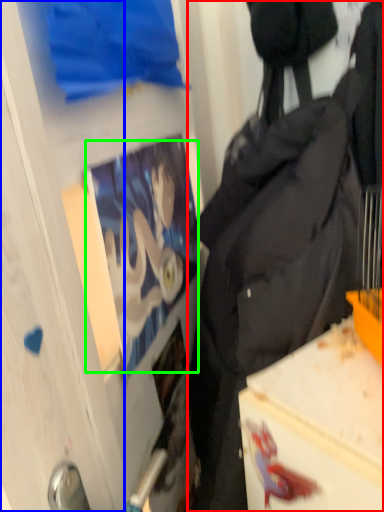
Question: Considering the real-world distances, which object is farthest from backpack (highlighted by a red box)? glass door (highlighted by a blue box) or person (highlighted by a green box)?

Choices:
 (A) glass door
 (B) person

Answer: (A)